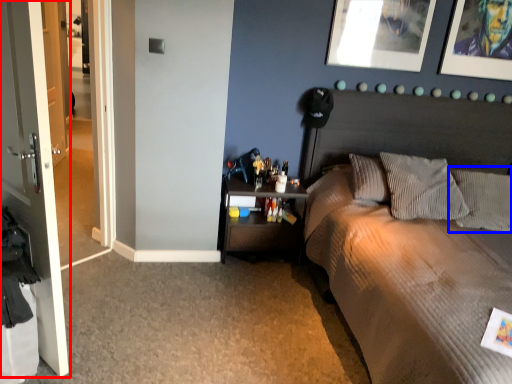
Question: Which of the following is the closest to the observer, door (highlighted by a red box) or pillow (highlighted by a blue box)?

Choices:
 (A) door
 (B) pillow

Answer: (A)